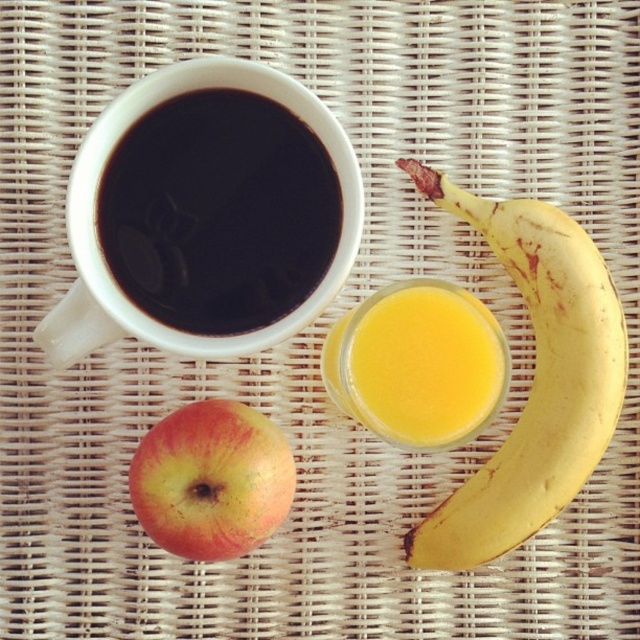
From the picture: You are a delivery robot that needs to place a small package on the table. The package must be placed exactly at the coordinates given for the translucent yellow liquid at center. What are the coordinates where you should place the package?

The coordinates for the translucent yellow liquid at center are at point (x=426, y=364). You should place the package at those coordinates.

You are setting up a breakfast tray and need to place a decorative plate at the center of the image. Considering the yellow matte banana at lower right, where should you position the plate to ensure it doesn

The yellow matte banana at lower right is located at point (532, 380), so positioning the decorative plate at the center would require placing it away from that coordinate to avoid overlapping with the banana.

You are setting up a table for a guest and need to place a decorative item between the black matte cup at upper left and the yellow matte banana at lower right. Based on their positions, which object should you place the item closer to?

You should place the decorative item closer to the black matte cup at upper left because it is closer to the viewer than the yellow matte banana at lower right.